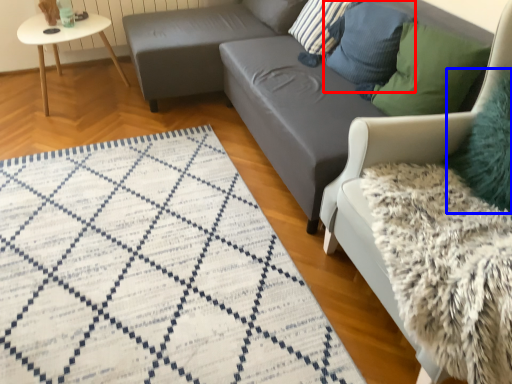
Question: Which object appears closest to the camera in this image, pillow (highlighted by a red box) or pillow (highlighted by a blue box)?

Choices:
 (A) pillow
 (B) pillow

Answer: (B)